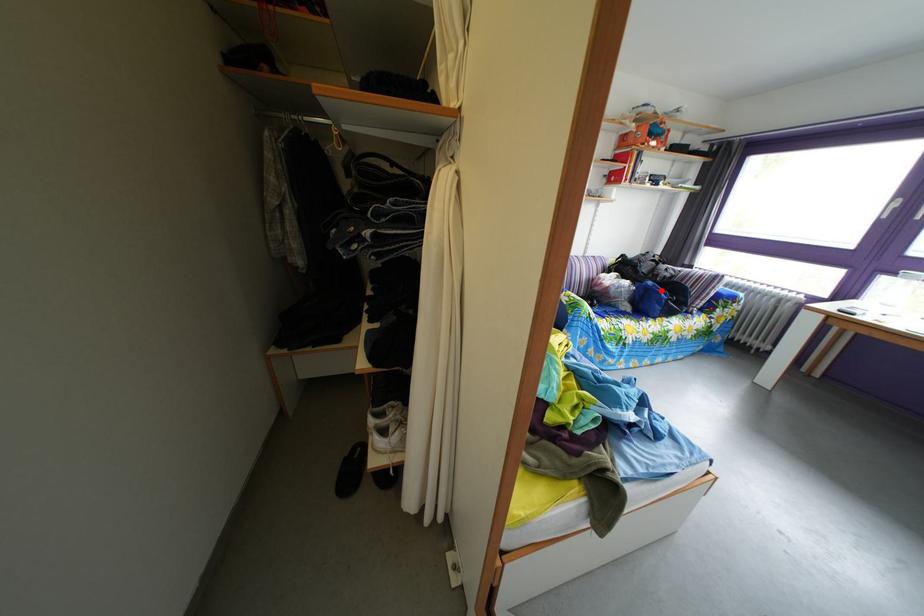
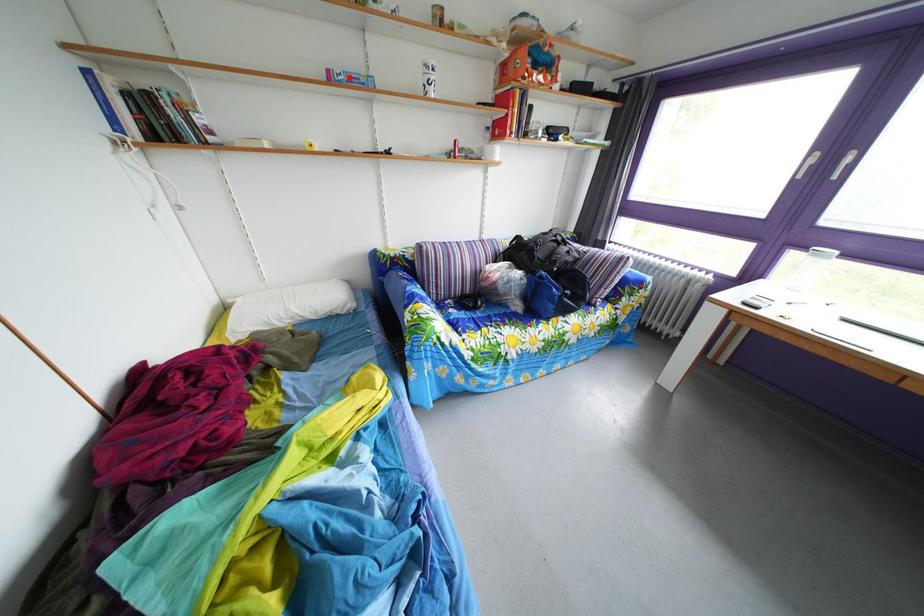
I am providing you with two images of the same scene from different viewpoints. A red point is marked on the first image and another point is marked on the second image. Is the marked point in image1 the same physical position as the marked point in image2?

No